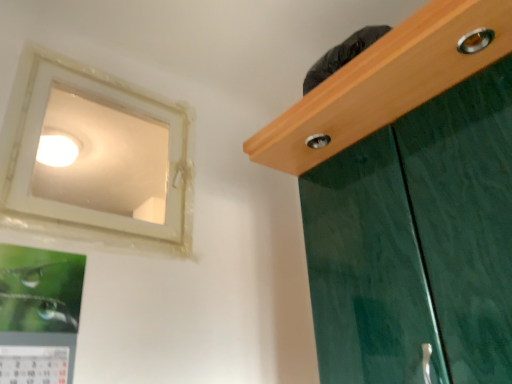
Question: Is white plastic window at upper left wider than metallic silver picture frame at lower left?

Choices:
 (A) no
 (B) yes

Answer: (A)

Question: Are white plastic window at upper left and metallic silver picture frame at lower left making contact?

Choices:
 (A) no
 (B) yes

Answer: (A)

Question: Is white plastic window at upper left oriented towards metallic silver picture frame at lower left?

Choices:
 (A) yes
 (B) no

Answer: (B)

Question: From a real-world perspective, is white plastic window at upper left physically above metallic silver picture frame at lower left?

Choices:
 (A) yes
 (B) no

Answer: (A)

Question: Does white plastic window at upper left have a lesser width compared to metallic silver picture frame at lower left?

Choices:
 (A) no
 (B) yes

Answer: (B)

Question: In terms of size, does white plastic window at upper left appear bigger or smaller than white glossy light fixture at upper left?

Choices:
 (A) small
 (B) big

Answer: (B)

Question: From the image's perspective, is white plastic window at upper left above or below white glossy light fixture at upper left?

Choices:
 (A) above
 (B) below

Answer: (B)

Question: Is point [x=10, y=167] closer or farther from the camera than point [x=60, y=162]?

Choices:
 (A) farther
 (B) closer

Answer: (B)

Question: From their relative heights in the image, would you say white plastic window at upper left is taller or shorter than white glossy light fixture at upper left?

Choices:
 (A) short
 (B) tall

Answer: (B)

Question: Is metallic silver picture frame at lower left inside the boundaries of white glossy light fixture at upper left, or outside?

Choices:
 (A) inside
 (B) outside

Answer: (B)

Question: From a real-world perspective, relative to white glossy light fixture at upper left, is metallic silver picture frame at lower left vertically above or below?

Choices:
 (A) above
 (B) below

Answer: (B)

Question: Is metallic silver picture frame at lower left taller or shorter than white glossy light fixture at upper left?

Choices:
 (A) short
 (B) tall

Answer: (B)

Question: Considering the positions of metallic silver picture frame at lower left and white glossy light fixture at upper left in the image, is metallic silver picture frame at lower left bigger or smaller than white glossy light fixture at upper left?

Choices:
 (A) big
 (B) small

Answer: (A)

Question: Is white plastic window at upper left inside or outside of metallic silver picture frame at lower left?

Choices:
 (A) inside
 (B) outside

Answer: (B)

Question: In the image, is white plastic window at upper left positioned in front of or behind metallic silver picture frame at lower left?

Choices:
 (A) behind
 (B) front

Answer: (A)